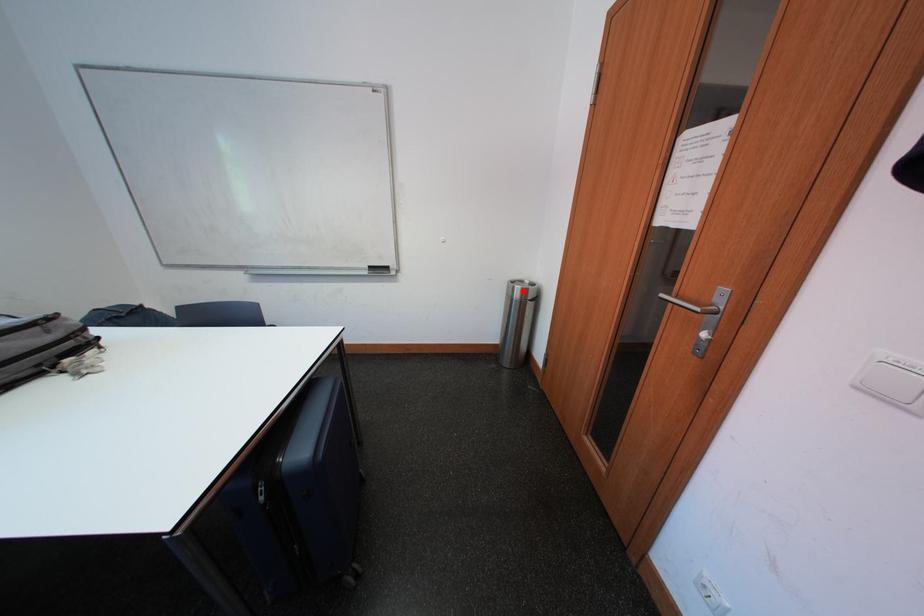
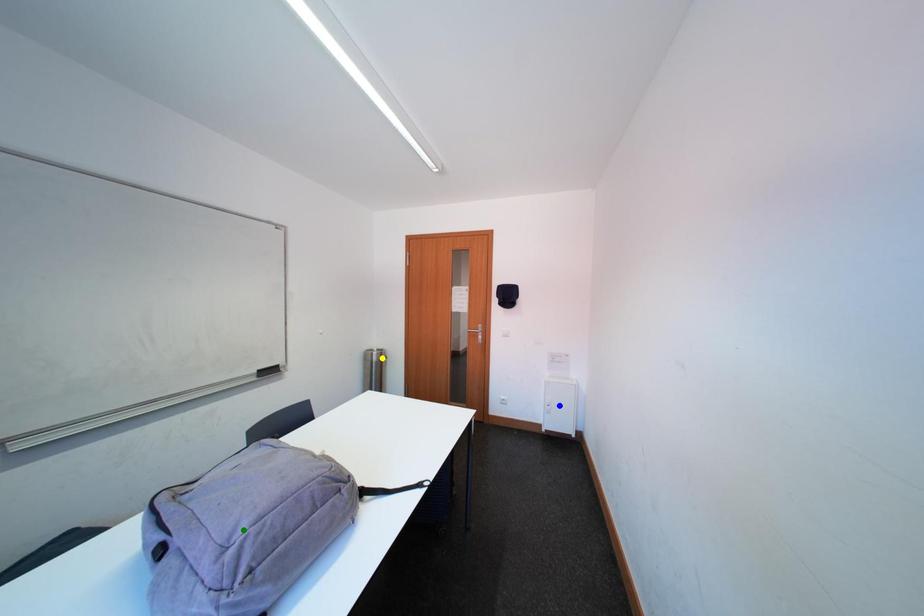
Question: I am providing you with two images of the same scene from different viewpoints. A red point is marked on the first image. You are given multiple points on the second image. Which point in image 2 is actually the same real-world point as the red point in image 1?

Choices:
 (A) blue point
 (B) green point
 (C) yellow point

Answer: (C)